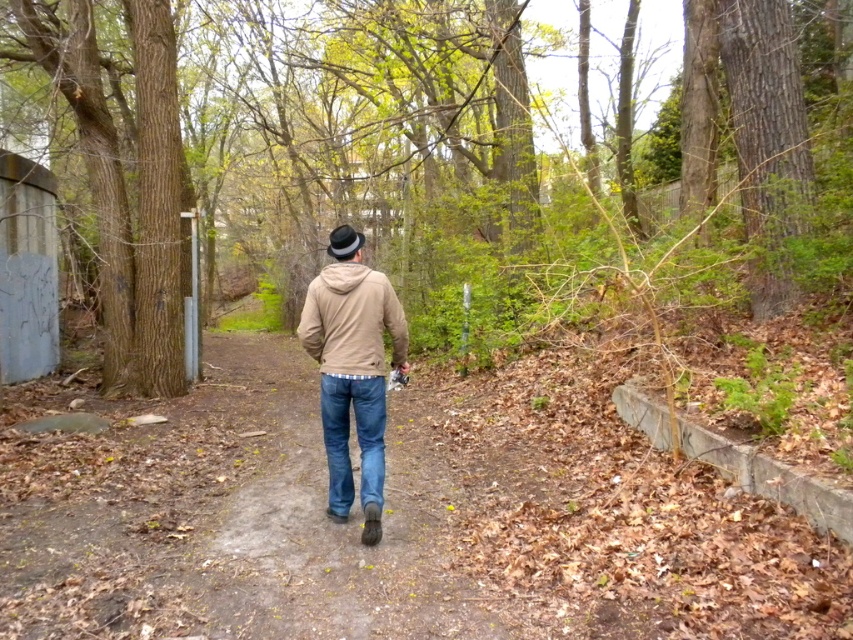
You are a photographer trying to capture a candid shot of the person in the scene. You notice the matte beige jacket at center and the denim jeans at center. Which item should you focus on first if you want to ensure both are in focus without adjusting your camera settings?

The denim jeans at center is behind the matte beige jacket at center, so you should focus on the matte beige jacket at center first. This way, since it is closer to the camera, the depth of field will naturally include the denim jeans at center in focus as well.

You are standing at the camera position looking at the person wearing both the matte brown jacket at center and the matte beige jacket at center. Which jacket is positioned lower on the person?

The matte brown jacket at center is positioned lower because it is below the matte beige jacket at center.

You are a fashion designer analyzing the clothing of a person in a photo. You need to determine which item of clothing is positioned higher on their body between the matte brown jacket at center and the denim jeans at center. Which one is taller?

The matte brown jacket at center is much taller as denim jeans at center, so the matte brown jacket at center is positioned higher on their body.